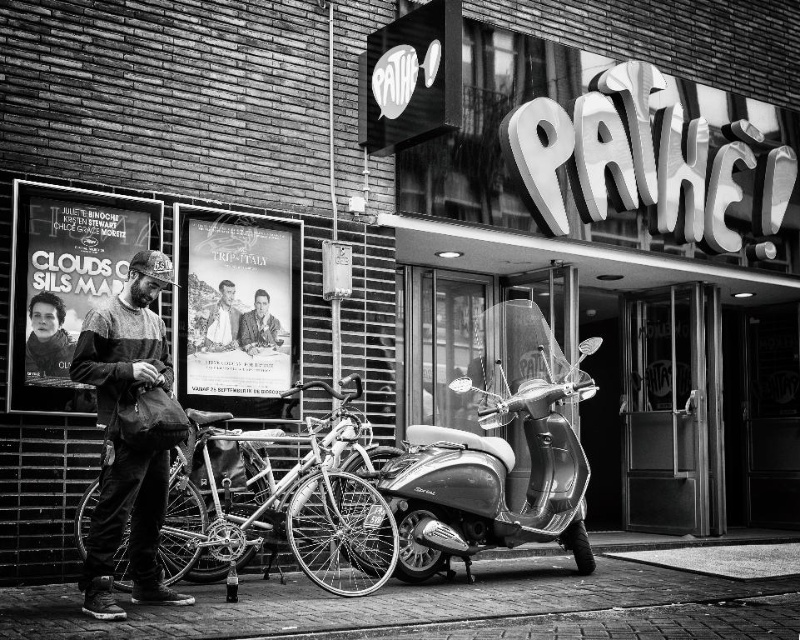
You are a photographer trying to capture both the smooth skin face at center and the smooth leather jacket at center in a single frame. Based on their widths, which object should you adjust your camera angle to prioritize to ensure both fit in the frame?

The smooth skin face at center is wider than the smooth leather jacket at center, so you should adjust your camera angle to prioritize capturing the width of the smooth skin face at center first to ensure both fit in the frame.

From the picture: You are standing at the entrance of the cinema and want to walk towards the brick pavement at lower center. Is the smooth leather jacket at center blocking your path?

The brick pavement at lower center is in front of the smooth leather jacket at center, so the jacket is behind the pavement and not blocking your path.

From the picture: You are a photographer standing 10 feet away from the Path? cinema entrance. You want to take a photo of both the smooth skin face at center and the smooth leather jacket at center in the same frame. Can you do it with a standard camera lens that has a 50mm focal length?

The smooth skin face at center is 6.25 inches away from the smooth leather jacket at center. With a standard 50mm lens, which has a typical field of view, you can easily capture both the smooth skin face at center and the smooth leather jacket at center in the same frame since they are only 6.25 inches apart.